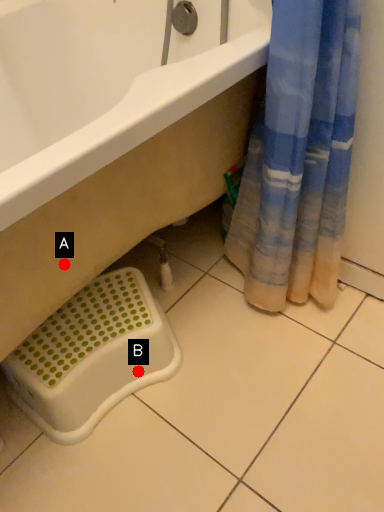
Question: Two points are circled on the image, labeled by A and B beside each circle. Which point appears closest to the camera in this image?

Choices:
 (A) A is closer
 (B) B is closer

Answer: (A)